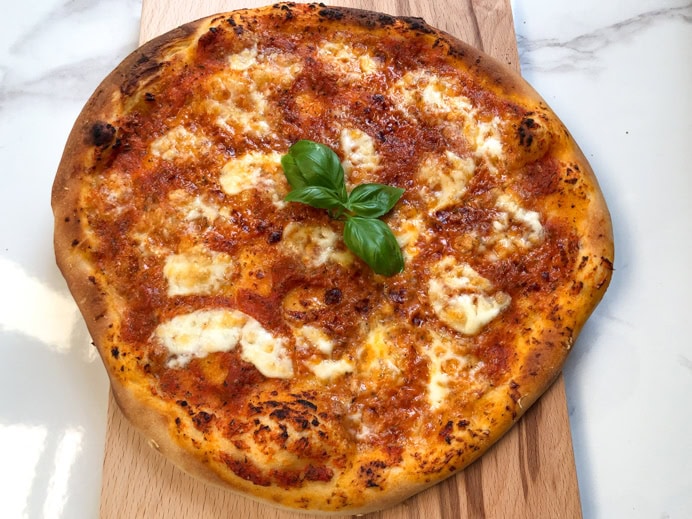
This screenshot has height=519, width=692. I want to click on marble countertop, so click(x=621, y=113).